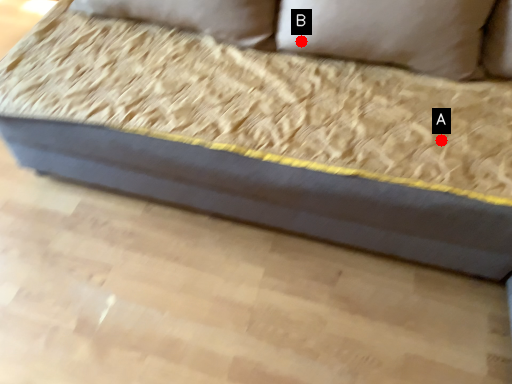
Question: Two points are circled on the image, labeled by A and B beside each circle. Among these points, which one is farthest from the camera?

Choices:
 (A) A is further
 (B) B is further

Answer: (B)